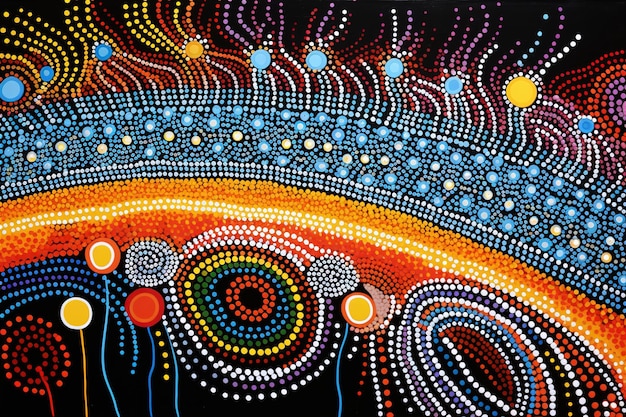
You are a GUI agent. You are given a task and a screenshot of the screen. Output one action in this format:
    pyautogui.click(x=<x>, y=<y>)
    Task: Click on the lightbulbs
    
    Given the screenshot: What is the action you would take?
    pyautogui.click(x=404, y=234)